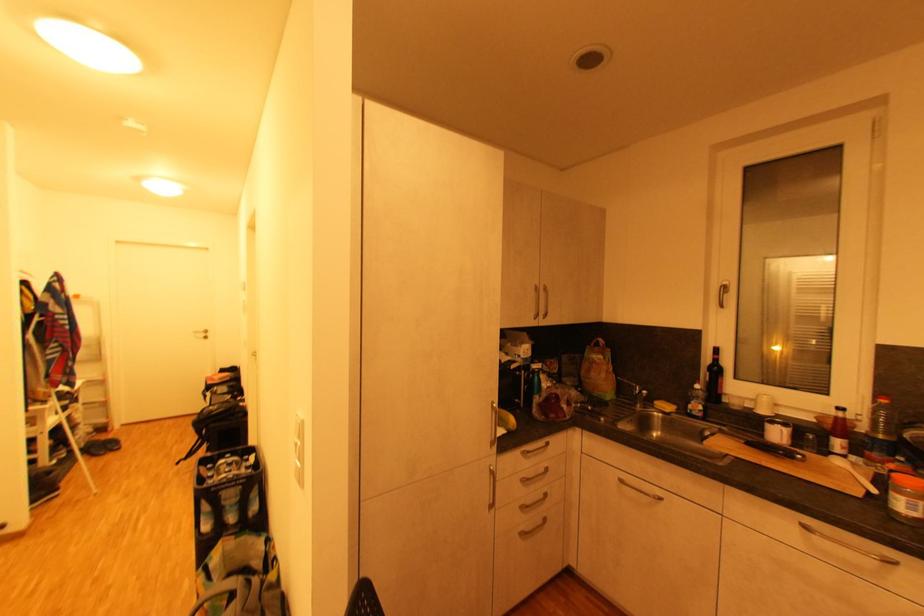
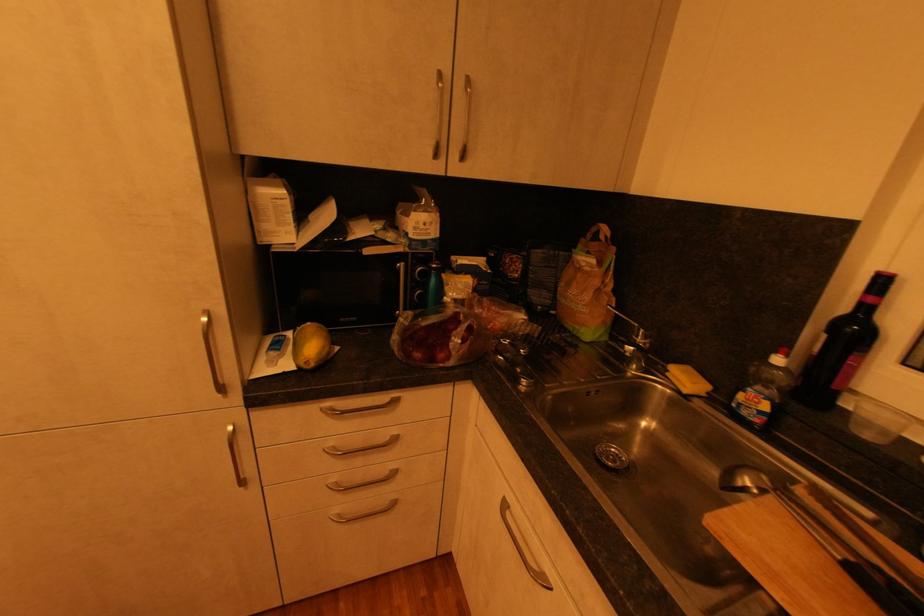
Where in the second image is the point corresponding to the point at 721,351 from the first image?

(889, 282)